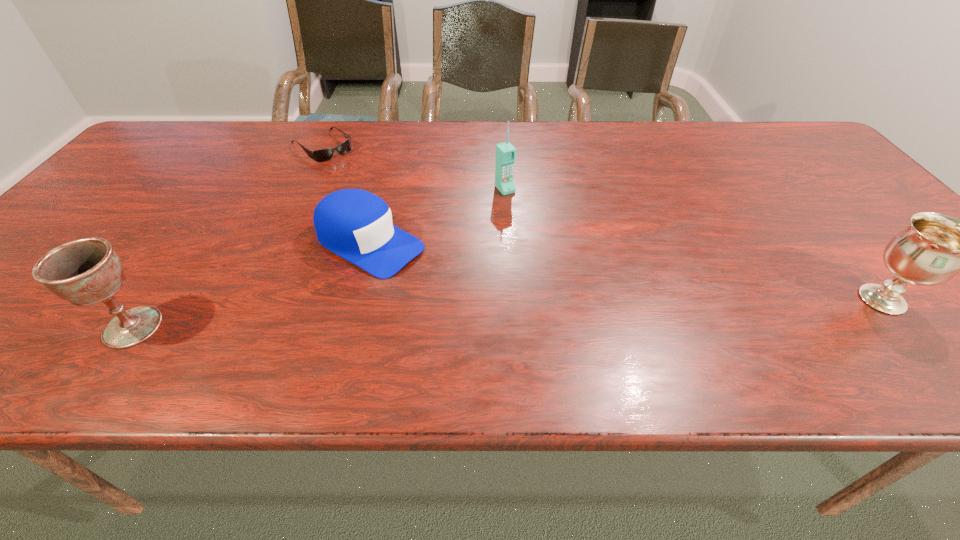
This screenshot has height=540, width=960. What are the coordinates of `vacant area in the image that satisfies the following two spatial constraints: 1. on the front side of the second farthest object; 2. on the right side of the sunglasses` in the screenshot? It's located at (301, 189).

What are the coordinates of `free region that satisfies the following two spatial constraints: 1. on the back side of the leftmost object; 2. on the right side of the right chalice` in the screenshot? It's located at (152, 300).

This screenshot has height=540, width=960. I want to click on free space that satisfies the following two spatial constraints: 1. on the front side of the fourth object from left to right; 2. on the right side of the right chalice, so click(513, 300).